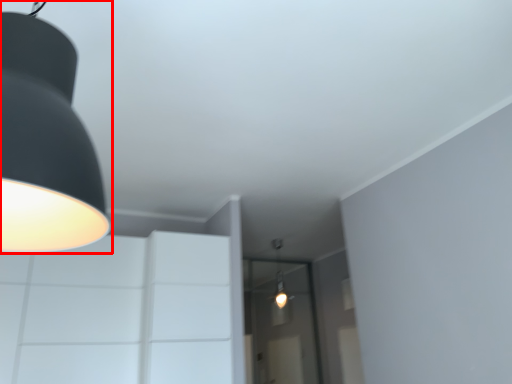
Question: Observing the image, what is the correct spatial positioning of lamp (annotated by the red box) in reference to glass door?

Choices:
 (A) left
 (B) right

Answer: (A)